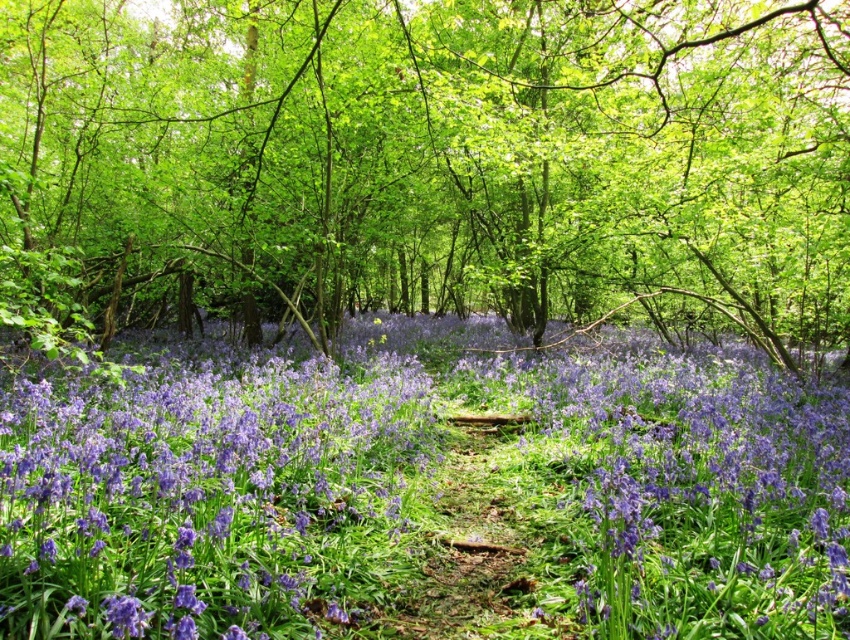
Question: Is green leafy tree at center in front of purple matte flower at center?

Choices:
 (A) no
 (B) yes

Answer: (B)

Question: Where is green leafy tree at center located in relation to purple matte flower at center in the image?

Choices:
 (A) right
 (B) left

Answer: (B)

Question: Observing the image, what is the correct spatial positioning of green leafy tree at center in reference to purple matte flower at center?

Choices:
 (A) above
 (B) below

Answer: (A)

Question: Among these objects, which one is nearest to the camera?

Choices:
 (A) green leafy tree at center
 (B) purple matte flower at center

Answer: (A)